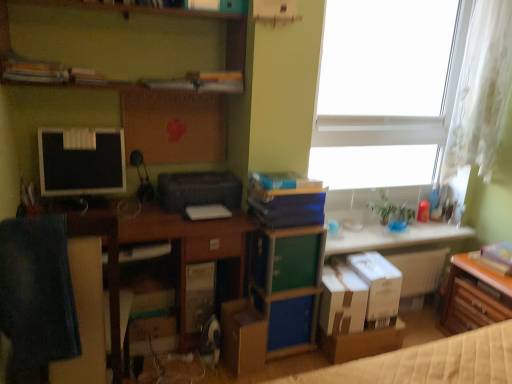
Question: Is black plastic printer at center wider than brown cardboard box at lower right, acting as the 1th cardboard box starting from the right?

Choices:
 (A) no
 (B) yes

Answer: (B)

Question: Considering the relative sizes of black plastic printer at center and brown cardboard box at lower right, acting as the 1th cardboard box starting from the right, in the image provided, is black plastic printer at center thinner than brown cardboard box at lower right, acting as the 1th cardboard box starting from the right,?

Choices:
 (A) yes
 (B) no

Answer: (B)

Question: Is black plastic printer at center not within brown cardboard box at lower right, which appears as the 4th cardboard box when viewed from the left?

Choices:
 (A) yes
 (B) no

Answer: (A)

Question: Considering the relative sizes of black plastic printer at center and brown cardboard box at lower right, which appears as the 4th cardboard box when viewed from the left, in the image provided, is black plastic printer at center shorter than brown cardboard box at lower right, which appears as the 4th cardboard box when viewed from the left,?

Choices:
 (A) no
 (B) yes

Answer: (B)

Question: Is black plastic printer at center facing towards brown cardboard box at lower right, acting as the 1th cardboard box starting from the right?

Choices:
 (A) no
 (B) yes

Answer: (A)

Question: Is white cardboard box at center, the 3th cardboard box viewed from the right, situated inside white matte window at upper right or outside?

Choices:
 (A) inside
 (B) outside

Answer: (B)

Question: From the image's perspective, relative to white matte window at upper right, is white cardboard box at center, which is the second cardboard box in left-to-right order, above or below?

Choices:
 (A) above
 (B) below

Answer: (B)

Question: Considering their positions, is white cardboard box at center, which is the second cardboard box in left-to-right order, located in front of or behind white matte window at upper right?

Choices:
 (A) front
 (B) behind

Answer: (A)

Question: Would you say white cardboard box at center, the 3th cardboard box viewed from the right, is to the left or to the right of white matte window at upper right in the picture?

Choices:
 (A) left
 (B) right

Answer: (A)

Question: Based on their positions, is brown cardboard box at lower right, acting as the 1th cardboard box starting from the right, located to the left or right of wooden drawer at lower right, the 1th table positioned from the bottom?

Choices:
 (A) left
 (B) right

Answer: (A)

Question: From a real-world perspective, is brown cardboard box at lower right, acting as the 1th cardboard box starting from the right, positioned above or below wooden drawer at lower right, the 1th table positioned from the bottom?

Choices:
 (A) above
 (B) below

Answer: (A)

Question: Relative to wooden drawer at lower right, the second table when ordered from top to bottom, is brown cardboard box at lower right, which appears as the 4th cardboard box when viewed from the left, in front or behind?

Choices:
 (A) front
 (B) behind

Answer: (B)

Question: From the image's perspective, is brown cardboard box at lower right, acting as the 1th cardboard box starting from the right, above or below wooden drawer at lower right, the second table when ordered from top to bottom?

Choices:
 (A) below
 (B) above

Answer: (B)

Question: Is point (53, 173) closer or farther from the camera than point (275, 180)?

Choices:
 (A) closer
 (B) farther

Answer: (A)

Question: Considering their positions, is matte black monitor at left located in front of or behind blue hardcover book at center, which appears as the second book when viewed from the right?

Choices:
 (A) behind
 (B) front

Answer: (A)